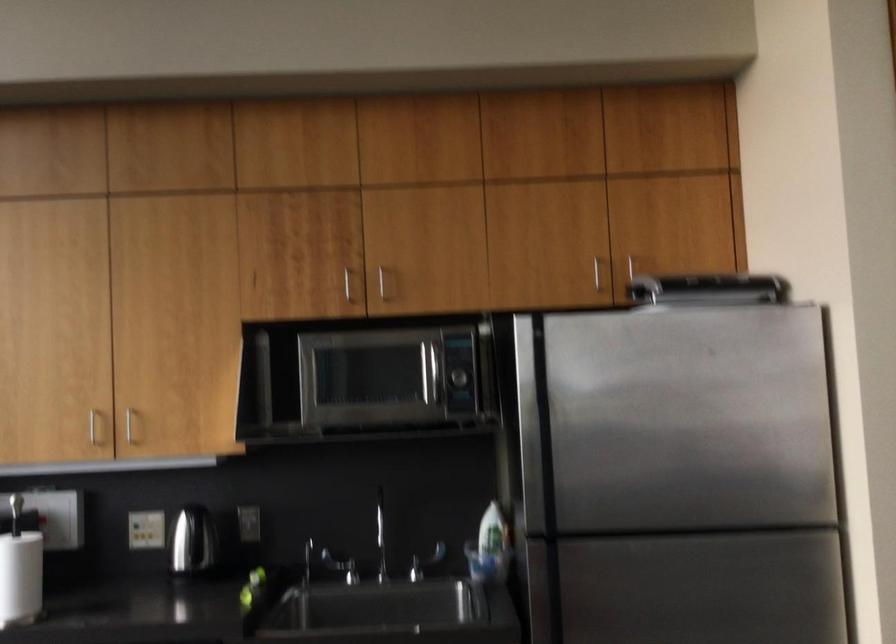
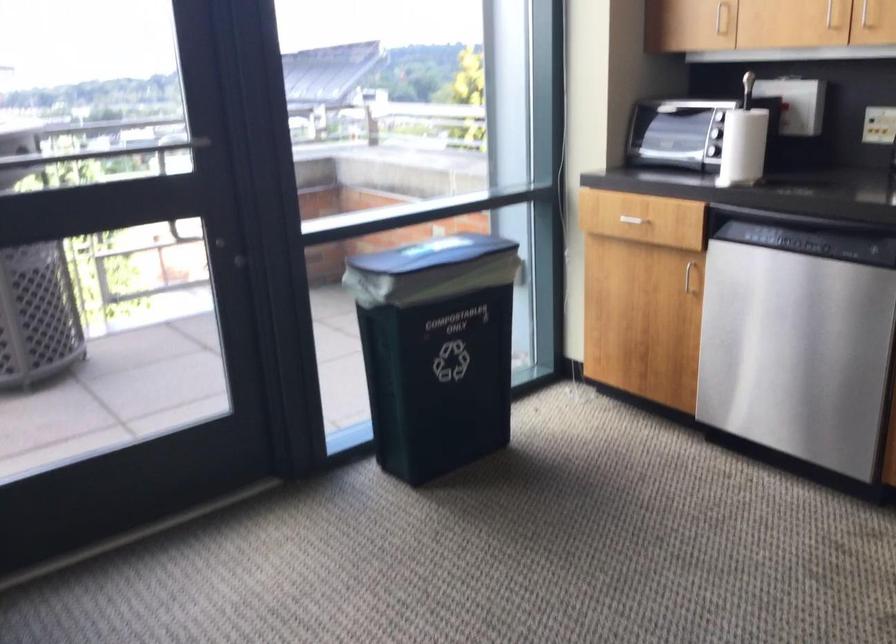
Based on the continuous images, in which direction is the camera rotating?

The rotation direction of the camera is left-down.